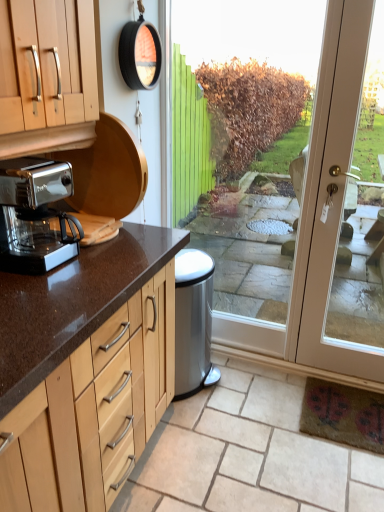
Question: Considering the relative sizes of light brown wood at lower left and metallic glass coffee maker at left in the image provided, is light brown wood at lower left taller than metallic glass coffee maker at left?

Choices:
 (A) yes
 (B) no

Answer: (B)

Question: Considering the relative positions of light brown wood at lower left and metallic glass coffee maker at left in the image provided, is light brown wood at lower left to the left of metallic glass coffee maker at left from the viewer's perspective?

Choices:
 (A) no
 (B) yes

Answer: (A)

Question: Considering the relative sizes of light brown wood at lower left and metallic glass coffee maker at left in the image provided, is light brown wood at lower left thinner than metallic glass coffee maker at left?

Choices:
 (A) yes
 (B) no

Answer: (B)

Question: Is light brown wood at lower left smaller than metallic glass coffee maker at left?

Choices:
 (A) yes
 (B) no

Answer: (B)

Question: From a real-world perspective, does light brown wood at lower left stand above metallic glass coffee maker at left?

Choices:
 (A) yes
 (B) no

Answer: (B)

Question: In terms of size, does light brown wood at lower left appear bigger or smaller than transparent glass door at center?

Choices:
 (A) small
 (B) big

Answer: (A)

Question: In terms of width, does light brown wood at lower left look wider or thinner when compared to transparent glass door at center?

Choices:
 (A) thin
 (B) wide

Answer: (B)

Question: Considering the positions of light brown wood at lower left and transparent glass door at center in the image, is light brown wood at lower left taller or shorter than transparent glass door at center?

Choices:
 (A) tall
 (B) short

Answer: (B)

Question: Based on their positions, is light brown wood at lower left located to the left or right of transparent glass door at center?

Choices:
 (A) right
 (B) left

Answer: (B)

Question: From the image's perspective, relative to transparent glass door at center, is metallic glass coffee maker at left above or below?

Choices:
 (A) below
 (B) above

Answer: (A)

Question: Choose the correct answer: Is metallic glass coffee maker at left inside transparent glass door at center or outside it?

Choices:
 (A) outside
 (B) inside

Answer: (A)

Question: Considering the positions of metallic glass coffee maker at left and transparent glass door at center in the image, is metallic glass coffee maker at left bigger or smaller than transparent glass door at center?

Choices:
 (A) big
 (B) small

Answer: (B)

Question: Considering the positions of metallic glass coffee maker at left and transparent glass door at center in the image, is metallic glass coffee maker at left wider or thinner than transparent glass door at center?

Choices:
 (A) thin
 (B) wide

Answer: (B)

Question: Considering the positions of point coord(190,474) and point coord(19,190), is point coord(190,474) closer or farther from the camera than point coord(19,190)?

Choices:
 (A) closer
 (B) farther

Answer: (B)

Question: Is light brown wood at lower left taller or shorter than metallic glass coffee maker at left?

Choices:
 (A) short
 (B) tall

Answer: (A)